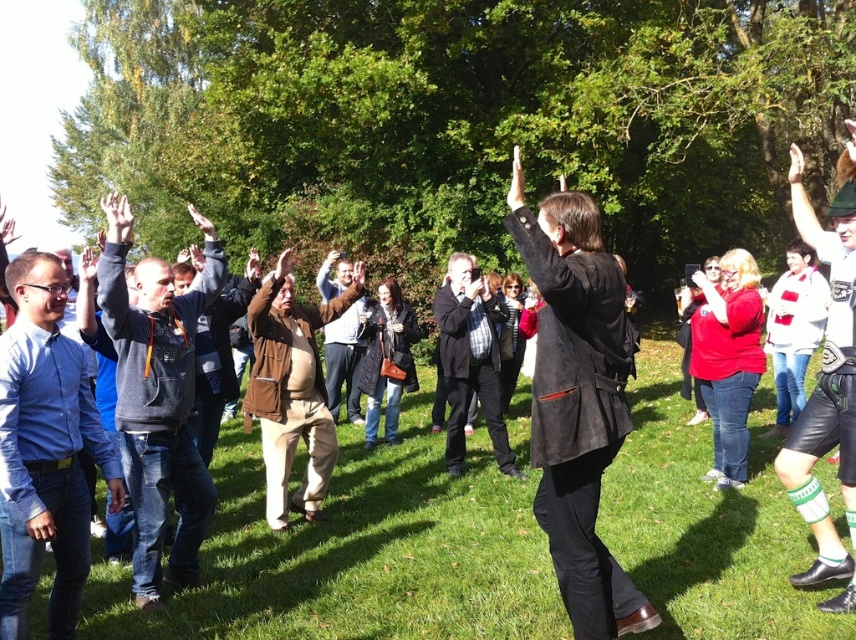
Question: Is green grass at center smaller than brown leather jacket at center?

Choices:
 (A) yes
 (B) no

Answer: (A)

Question: Based on their relative distances, which object is farther from the matte brown jacket at center?

Choices:
 (A) green grass at center
 (B) green leather shorts at center
 (C) plaid fabric shirt at center

Answer: (B)

Question: Which point is farther from the camera taking this photo?

Choices:
 (A) (174, 468)
 (B) (565, 364)

Answer: (A)

Question: Which object is positioned farthest from the matte brown jacket at center?

Choices:
 (A) matte black jacket at center
 (B) blue shirt at left

Answer: (A)

Question: Is green grass at center further to the viewer compared to brown leather jacket at center?

Choices:
 (A) yes
 (B) no

Answer: (B)

Question: Does plaid fabric shirt at center have a greater width compared to matte brown jacket at center?

Choices:
 (A) no
 (B) yes

Answer: (B)